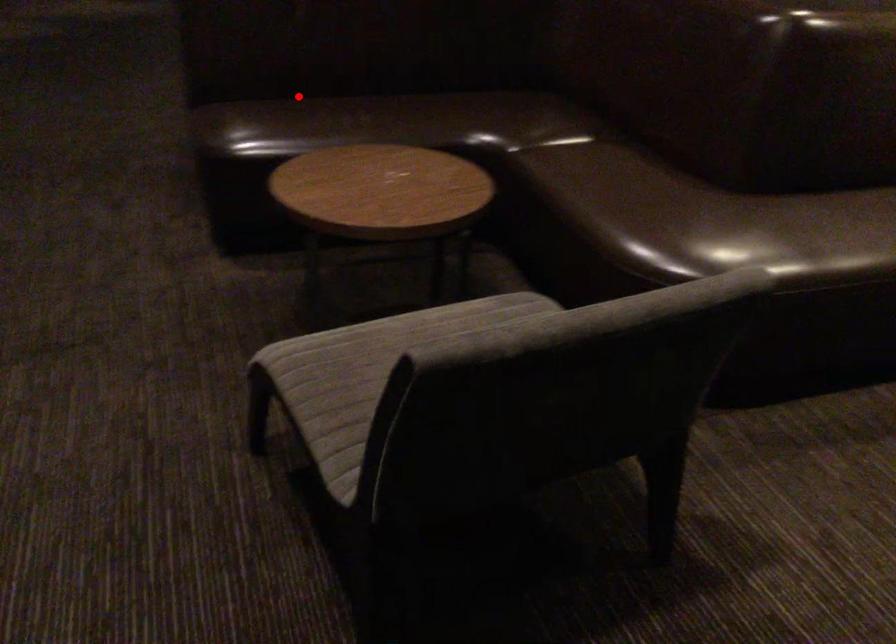
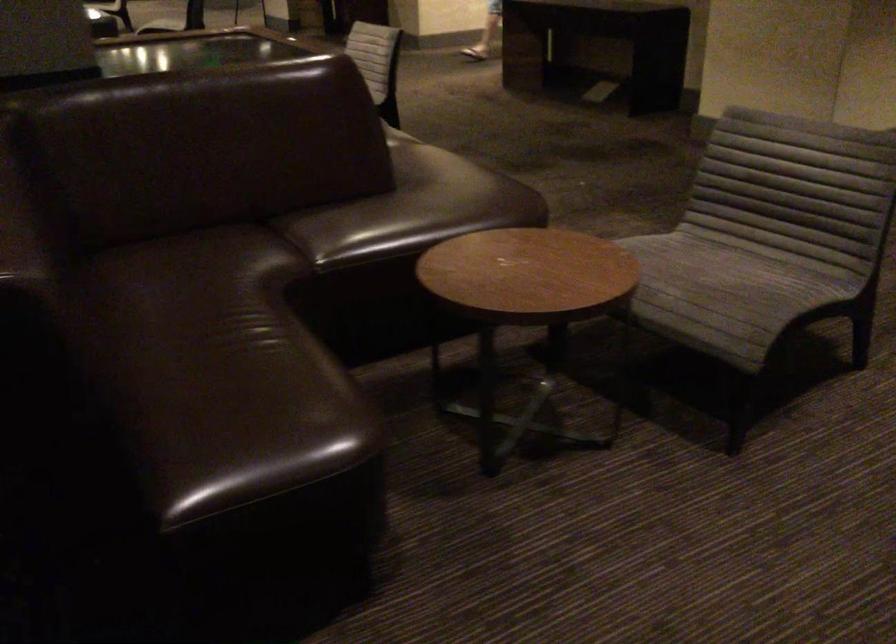
Question: I am providing you with two images of the same scene from different viewpoints. Image1 has a red point marked. In image2, the corresponding 3D location appears at what relative position? Reply with the corresponding letter.

Choices:
 (A) Closer
 (B) Farther

Answer: (A)